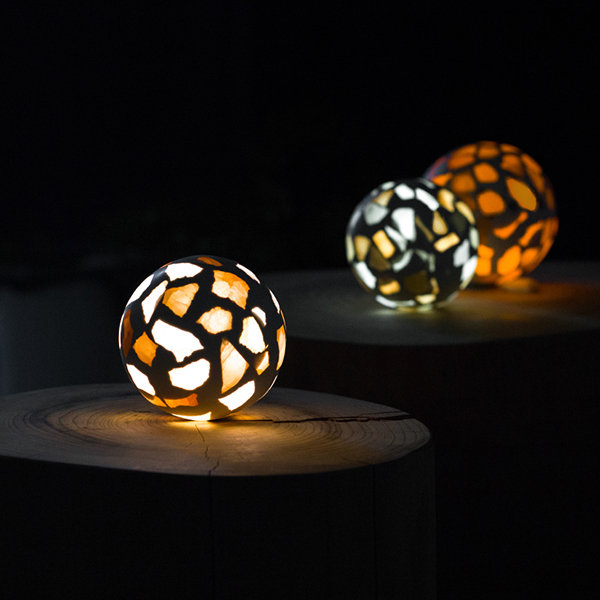
You are a GUI agent. You are given a task and a screenshot of the screen. Output one action in this format:
    pyautogui.click(x=<x>, y=<y>)
    Task: Click on the decretive ball
    This screenshot has width=600, height=600.
    Given the screenshot: What is the action you would take?
    pyautogui.click(x=425, y=231)